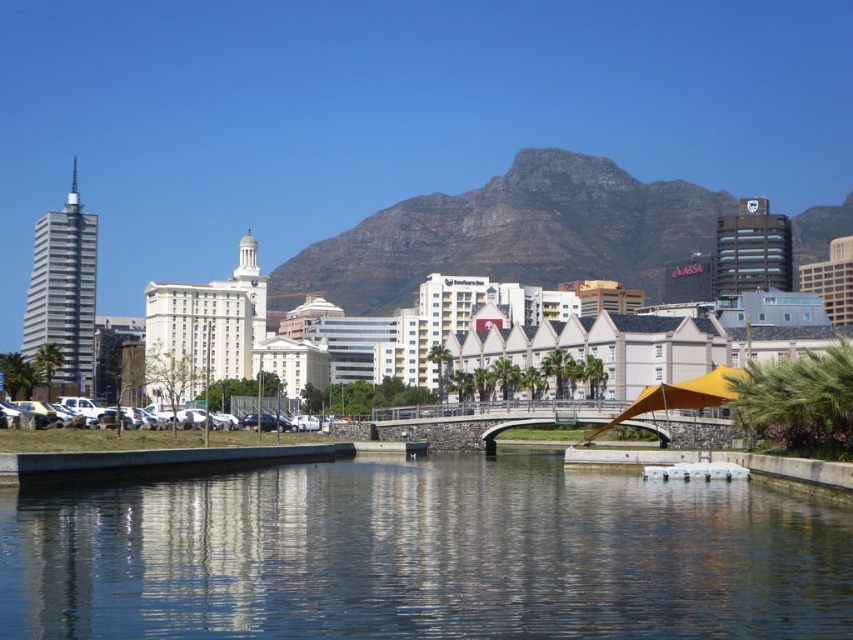
Which of these two, transparent glass water at center or yellow fabric umbrella at center, stands shorter?

Standing shorter between the two is transparent glass water at center.

Which is more to the left, transparent glass water at center or yellow fabric umbrella at center?

transparent glass water at center

At what (x,y) coordinates should I click in order to perform the action: click on transparent glass water at center. Please return your answer as a coordinate pair (x, y). Looking at the image, I should click on (422, 556).

In the scene shown: Is transparent glass water at center wider than rugged stone mountain at center?

In fact, transparent glass water at center might be narrower than rugged stone mountain at center.

Can you confirm if transparent glass water at center is positioned to the right of rugged stone mountain at center?

In fact, transparent glass water at center is to the left of rugged stone mountain at center.

Describe the element at coordinates (422, 556) in the screenshot. I see `transparent glass water at center` at that location.

Image resolution: width=853 pixels, height=640 pixels. In order to click on transparent glass water at center in this screenshot , I will do `click(422, 556)`.

Can you confirm if rugged stone mountain at center is wider than yellow fabric umbrella at center?

Indeed, rugged stone mountain at center has a greater width compared to yellow fabric umbrella at center.

Which of these two, rugged stone mountain at center or yellow fabric umbrella at center, stands shorter?

With less height is yellow fabric umbrella at center.

Describe the element at coordinates (512, 234) in the screenshot. The image size is (853, 640). I see `rugged stone mountain at center` at that location.

At what (x,y) coordinates should I click in order to perform the action: click on rugged stone mountain at center. Please return your answer as a coordinate pair (x, y). The height and width of the screenshot is (640, 853). Looking at the image, I should click on point(512,234).